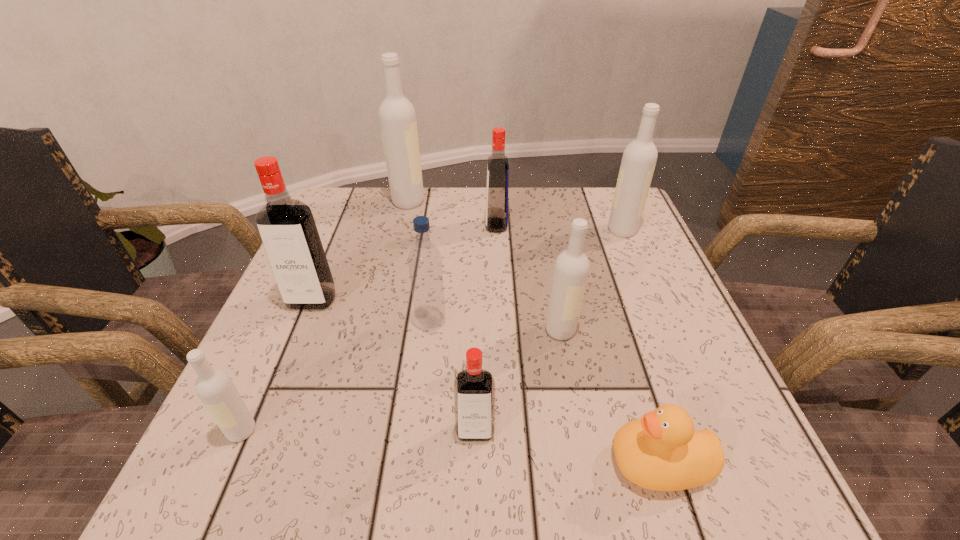
You are a GUI agent. You are given a task and a screenshot of the screen. Output one action in this format:
    pyautogui.click(x=<x>, y=<y>)
    Task: Click on the farthest object
    
    Given the screenshot: What is the action you would take?
    pyautogui.click(x=397, y=117)

Locate an element on the screen. the third object from left to right is located at coordinates (397, 117).

Find the location of a particular element. The height and width of the screenshot is (540, 960). the third nearest white vodka is located at coordinates (639, 159).

Where is `the third smallest white vodka`? This screenshot has width=960, height=540. the third smallest white vodka is located at coordinates (639, 159).

I want to click on the fourth farthest vodka, so click(x=286, y=226).

At what (x,y) coordinates should I click in order to perform the action: click on the second nearest red vodka. Please return your answer as a coordinate pair (x, y). The width and height of the screenshot is (960, 540). Looking at the image, I should click on click(x=286, y=226).

Where is `the second biggest red vodka`? The image size is (960, 540). the second biggest red vodka is located at coordinates (497, 167).

The width and height of the screenshot is (960, 540). In order to click on the second vodka from right to left in this screenshot , I will do `click(571, 269)`.

The height and width of the screenshot is (540, 960). What are the coordinates of `the third nearest vodka` in the screenshot? It's located at (571, 269).

Identify the location of the fourth object from left to right. The image size is (960, 540). (425, 262).